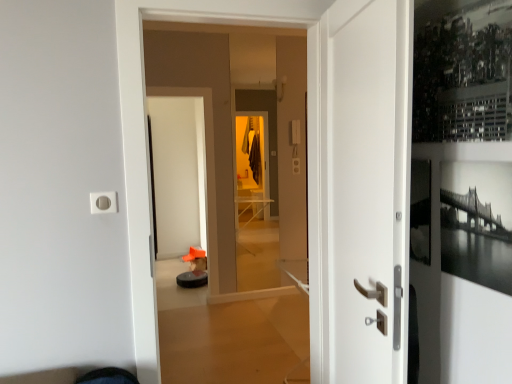
What do you see at coordinates (309, 169) in the screenshot?
I see `white glossy door at center, which is the 1th door from left to right` at bounding box center [309, 169].

What is the approximate height of black plastic robot vacuum cleaner at lower center?

black plastic robot vacuum cleaner at lower center is 4.52 inches in height.

What are the coordinates of `black glossy screen door at center` in the screenshot? It's located at (178, 173).

Find the location of a particular element. This screenshot has height=384, width=512. white glossy door at center, which is the 1th door from left to right is located at coordinates (309, 169).

Can you tell me how much white glossy door at center, which is the 1th door from left to right, and white matte door at center, positioned as the second door in left-to-right order, differ in facing direction?

They differ by 101 degrees in their facing directions.

Does white glossy door at center, the second door positioned from the right, appear on the left side of white matte door at center, positioned as the second door in left-to-right order?

Yes, white glossy door at center, the second door positioned from the right, is to the left of white matte door at center, positioned as the second door in left-to-right order.

In terms of height, does white glossy door at center, the second door positioned from the right, look taller or shorter compared to white matte door at center, positioned as the second door in left-to-right order?

In the image, white glossy door at center, the second door positioned from the right, appears to be taller than white matte door at center, positioned as the second door in left-to-right order.

Are white glossy door at center, which is the 1th door from left to right, and white matte door at center, which appears as the 1th door when viewed from the right, located far from each other?

No, white glossy door at center, which is the 1th door from left to right, is not far from white matte door at center, which appears as the 1th door when viewed from the right.

Who is more distant, black glossy screen door at center or white glossy door at center, the second door positioned from the right?

Positioned behind is black glossy screen door at center.

Is white glossy door at center, which is the 1th door from left to right, at the back of black glossy screen door at center?

black glossy screen door at center does not have its back to white glossy door at center, which is the 1th door from left to right.

Who is smaller, black glossy screen door at center or white glossy door at center, the second door positioned from the right?

With smaller size is black glossy screen door at center.

Is point (206, 280) closer to camera compared to point (335, 16)?

No, it is not.

Is black plastic robot vacuum cleaner at lower center wider or thinner than white matte door at center, which appears as the 1th door when viewed from the right?

black plastic robot vacuum cleaner at lower center is wider than white matte door at center, which appears as the 1th door when viewed from the right.

From a real-world perspective, which object stands above the other?

In real-world perspective, white matte door at center, positioned as the second door in left-to-right order, is above.

Considering their positions, is black plastic robot vacuum cleaner at lower center located in front of or behind black glossy screen door at center?

black plastic robot vacuum cleaner at lower center is positioned farther from the viewer than black glossy screen door at center.

From the picture: Does black plastic robot vacuum cleaner at lower center have a greater height compared to black glossy screen door at center?

Incorrect, the height of black plastic robot vacuum cleaner at lower center is not larger of that of black glossy screen door at center.

How different are the orientations of black plastic robot vacuum cleaner at lower center and black glossy screen door at center in degrees?

The angular difference between black plastic robot vacuum cleaner at lower center and black glossy screen door at center is 4.89 degrees.

From a real-world perspective, which is physically below, black plastic robot vacuum cleaner at lower center or black glossy screen door at center?

black plastic robot vacuum cleaner at lower center.

Is black glossy screen door at center positioned with its back to white matte door at center, which appears as the 1th door when viewed from the right?

No, black glossy screen door at center is not facing the opposite direction of white matte door at center, which appears as the 1th door when viewed from the right.

Would you consider black glossy screen door at center to be distant from white matte door at center, positioned as the second door in left-to-right order?

black glossy screen door at center is positioned a significant distance from white matte door at center, positioned as the second door in left-to-right order.

Between point (179, 193) and point (346, 85), which one is positioned in front?

The point (346, 85) is closer.

Image resolution: width=512 pixels, height=384 pixels. I want to click on the 2nd door counting from the right of the black glossy screen door at center, so click(x=359, y=187).

This screenshot has height=384, width=512. In order to click on the 1st door to the right when counting from the black plastic robot vacuum cleaner at lower center in this screenshot , I will do `click(309, 169)`.

Is black plastic robot vacuum cleaner at lower center positioned in front of white glossy door at center, the second door positioned from the right?

No.

Is black plastic robot vacuum cleaner at lower center completely or partially outside of white glossy door at center, which is the 1th door from left to right?

Yes, black plastic robot vacuum cleaner at lower center is located beyond the bounds of white glossy door at center, which is the 1th door from left to right.

Is point (204, 273) positioned after point (137, 93)?

Yes, point (204, 273) is behind point (137, 93).

Would you say black glossy screen door at center is to the left or to the right of black plastic robot vacuum cleaner at lower center in the picture?

In the image, black glossy screen door at center appears on the left side of black plastic robot vacuum cleaner at lower center.

In terms of size, does black glossy screen door at center appear bigger or smaller than black plastic robot vacuum cleaner at lower center?

Clearly, black glossy screen door at center is larger in size than black plastic robot vacuum cleaner at lower center.

Would you say black glossy screen door at center contains black plastic robot vacuum cleaner at lower center?

No, black plastic robot vacuum cleaner at lower center is located outside of black glossy screen door at center.

The width and height of the screenshot is (512, 384). I want to click on furniture directly beneath the black glossy screen door at center (from a real-world perspective), so pyautogui.click(x=192, y=279).

At what (x,y) coordinates should I click in order to perform the action: click on door in front of the white glossy door at center, which is the 1th door from left to right. Please return your answer as a coordinate pair (x, y). This screenshot has width=512, height=384. Looking at the image, I should click on (359, 187).

Where is `screen door lying on the left of white glossy door at center, the second door positioned from the right`? screen door lying on the left of white glossy door at center, the second door positioned from the right is located at coordinates pyautogui.click(x=178, y=173).

Looking at the image, which one is located closer to white glossy door at center, the second door positioned from the right, black plastic robot vacuum cleaner at lower center or white matte door at center, positioned as the second door in left-to-right order?

white matte door at center, positioned as the second door in left-to-right order, is positioned closer to the anchor white glossy door at center, the second door positioned from the right.

Estimate the real-world distances between objects in this image. Which object is further from black plastic robot vacuum cleaner at lower center, white matte door at center, positioned as the second door in left-to-right order, or white glossy door at center, the second door positioned from the right?

Among the two, white matte door at center, positioned as the second door in left-to-right order, is located further to black plastic robot vacuum cleaner at lower center.

When comparing their distances from black plastic robot vacuum cleaner at lower center, does white matte door at center, positioned as the second door in left-to-right order, or black glossy screen door at center seem closer?

Among the two, black glossy screen door at center is located nearer to black plastic robot vacuum cleaner at lower center.

Which object lies nearer to the anchor point white matte door at center, which appears as the 1th door when viewed from the right, black glossy screen door at center or black plastic robot vacuum cleaner at lower center?

black plastic robot vacuum cleaner at lower center lies closer to white matte door at center, which appears as the 1th door when viewed from the right, than the other object.

From the image, which object appears to be farther from black plastic robot vacuum cleaner at lower center, black glossy screen door at center or white glossy door at center, the second door positioned from the right?

Based on the image, white glossy door at center, the second door positioned from the right, appears to be further to black plastic robot vacuum cleaner at lower center.

Estimate the real-world distances between objects in this image. Which object is further from white matte door at center, which appears as the 1th door when viewed from the right, white glossy door at center, which is the 1th door from left to right, or black plastic robot vacuum cleaner at lower center?

black plastic robot vacuum cleaner at lower center lies further to white matte door at center, which appears as the 1th door when viewed from the right, than the other object.

Looking at this image, from the image, which object appears to be nearer to black plastic robot vacuum cleaner at lower center, white glossy door at center, the second door positioned from the right, or white matte door at center, positioned as the second door in left-to-right order?

The object closer to black plastic robot vacuum cleaner at lower center is white glossy door at center, the second door positioned from the right.

Looking at the image, which one is located closer to white matte door at center, positioned as the second door in left-to-right order, black plastic robot vacuum cleaner at lower center or black glossy screen door at center?

black plastic robot vacuum cleaner at lower center.

In order to click on door located between white matte door at center, positioned as the second door in left-to-right order, and black plastic robot vacuum cleaner at lower center in the depth direction in this screenshot , I will do `click(309, 169)`.

Locate an element on the screen. The height and width of the screenshot is (384, 512). screen door between white matte door at center, positioned as the second door in left-to-right order, and black plastic robot vacuum cleaner at lower center, along the z-axis is located at coordinates (178, 173).

You are a GUI agent. You are given a task and a screenshot of the screen. Output one action in this format:
    pyautogui.click(x=<x>, y=<y>)
    Task: Click on the door between white matte door at center, which appears as the 1th door when viewed from the right, and black glossy screen door at center in the front-back direction
    
    Given the screenshot: What is the action you would take?
    tap(309, 169)

Locate an element on the screen. screen door between white glossy door at center, the second door positioned from the right, and black plastic robot vacuum cleaner at lower center, along the z-axis is located at coordinates (178, 173).